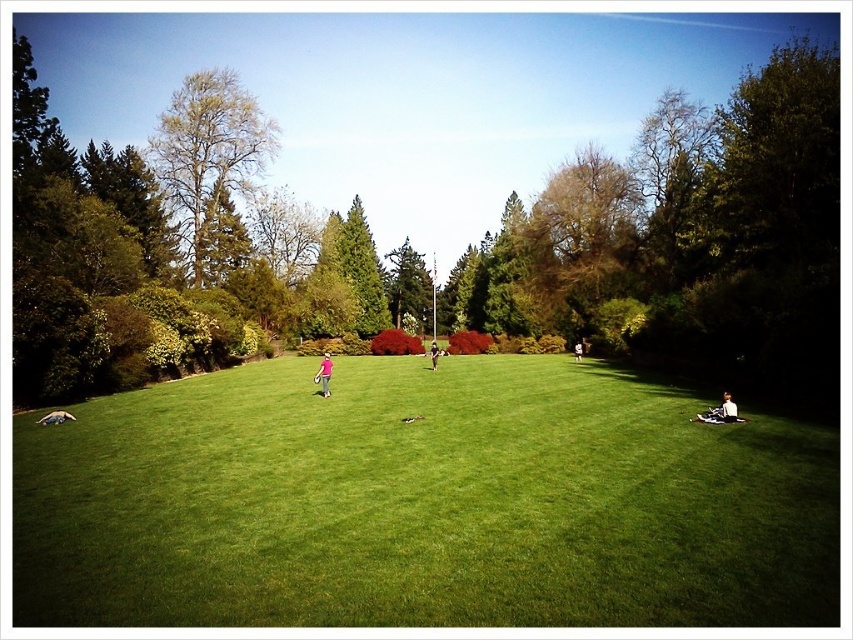
Question: Does green grass at center appear on the right side of light brown leather jacket at lower right?

Choices:
 (A) yes
 (B) no

Answer: (B)

Question: Which object is the closest to the green grass at center?

Choices:
 (A) light brown leather jacket at lower right
 (B) dark brown leather jacket at center
 (C) white fabric at center
 (D) bare wood tree at upper left

Answer: (A)

Question: Observing the image, what is the correct spatial positioning of bare wood tree at upper left in reference to dark brown leather jacket at center?

Choices:
 (A) right
 (B) left

Answer: (B)

Question: Among these objects, which one is farthest from the camera?

Choices:
 (A) green grass at center
 (B) pink fabric at center

Answer: (B)

Question: Is green leafy tree at center bigger than white fabric at center?

Choices:
 (A) no
 (B) yes

Answer: (B)

Question: Which point appears farthest from the camera in this image?

Choices:
 (A) (376, 616)
 (B) (44, 54)
 (C) (251, 152)

Answer: (B)